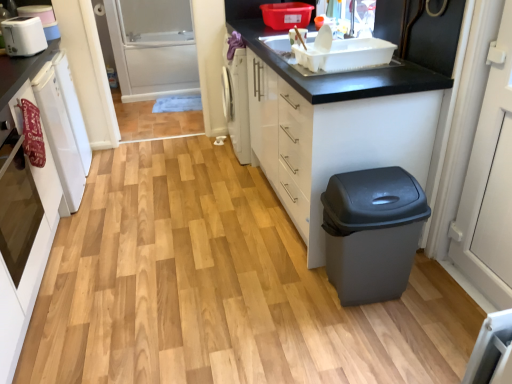
Identify the location of vacant space situated on the left part of white glossy cabinet at lower right, the first cabinetry when ordered from right to left. Image resolution: width=512 pixels, height=384 pixels. (198, 220).